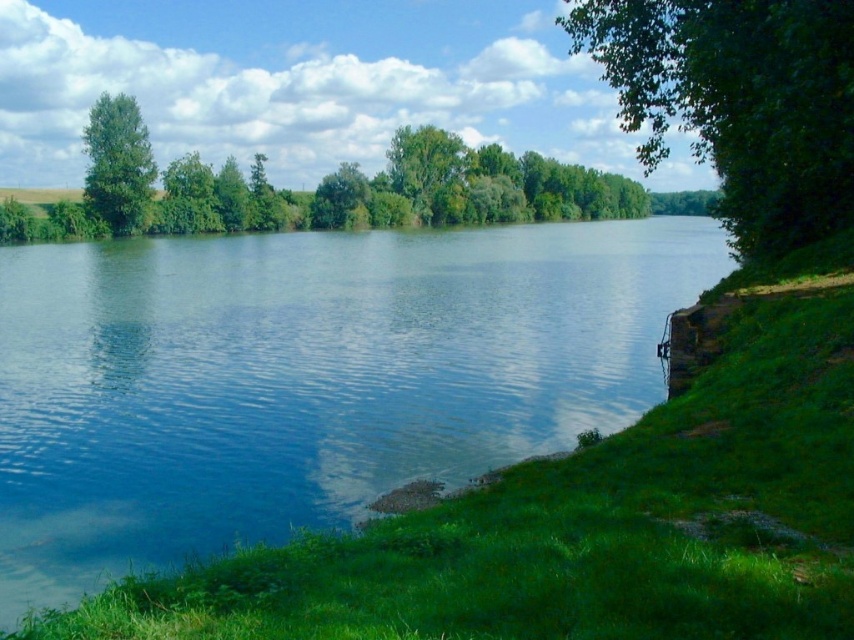
Is clear blue water at center shorter than green leafy tree at center?

Yes.

Looking at this image, who is more forward, (x=313, y=285) or (x=449, y=157)?

Positioned in front is point (x=313, y=285).

You are a GUI agent. You are given a task and a screenshot of the screen. Output one action in this format:
    pyautogui.click(x=<x>, y=<y>)
    Task: Click on the clear blue water at center
    
    Given the screenshot: What is the action you would take?
    pyautogui.click(x=305, y=378)

Measure the distance between clear blue water at center and green leafy tree at right.

They are 32.97 meters apart.

Between clear blue water at center and green leafy tree at right, which one appears on the left side from the viewer's perspective?

Positioned to the left is clear blue water at center.

Between point (560, 365) and point (835, 196), which one is positioned in front?

Point (560, 365) is more forward.

The height and width of the screenshot is (640, 854). In order to click on clear blue water at center in this screenshot , I will do `click(305, 378)`.

Between green leafy tree at right and green leafy tree at center, which one appears on the left side from the viewer's perspective?

From the viewer's perspective, green leafy tree at center appears more on the left side.

Does point (686, 97) come closer to viewer compared to point (404, 148)?

That is True.

Locate an element on the screen. This screenshot has width=854, height=640. green leafy tree at right is located at coordinates (740, 100).